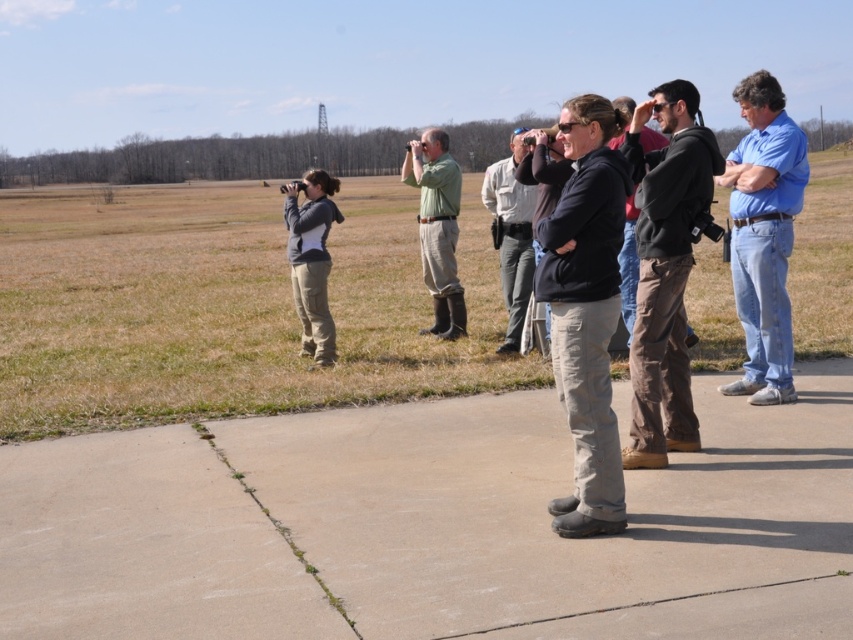
Does blue denim jeans at right have a greater height compared to dark gray hoodie at center?

Incorrect, blue denim jeans at right's height is not larger of dark gray hoodie at center's.

Which is below, blue denim jeans at right or dark gray hoodie at center?

blue denim jeans at right is lower down.

The height and width of the screenshot is (640, 853). I want to click on blue denim jeans at right, so click(764, 236).

Where is `blue denim jeans at right`? blue denim jeans at right is located at coordinates (764, 236).

Based on the photo, between concrete pavement at center and dark gray hoodie at center, which one is positioned higher?

Positioned higher is dark gray hoodie at center.

Does concrete pavement at center appear on the right side of dark gray hoodie at center?

No, concrete pavement at center is not to the right of dark gray hoodie at center.

This screenshot has width=853, height=640. I want to click on concrete pavement at center, so click(428, 525).

Locate an element on the screen. This screenshot has height=640, width=853. concrete pavement at center is located at coordinates (428, 525).

Who is shorter, concrete pavement at center or dark brown leather pants at center?

With less height is concrete pavement at center.

Measure the distance from concrete pavement at center to dark brown leather pants at center.

The distance of concrete pavement at center from dark brown leather pants at center is 5.27 feet.

You are a GUI agent. You are given a task and a screenshot of the screen. Output one action in this format:
    pyautogui.click(x=<x>, y=<y>)
    Task: Click on the concrete pavement at center
    Image resolution: width=853 pixels, height=640 pixels.
    Given the screenshot: What is the action you would take?
    pyautogui.click(x=428, y=525)

Locate an element on the screen. concrete pavement at center is located at coordinates (428, 525).